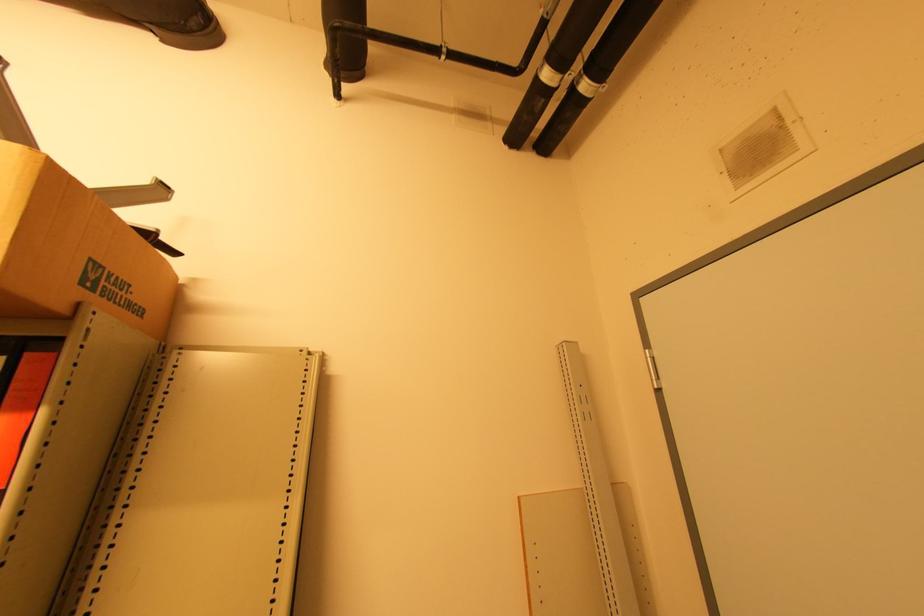
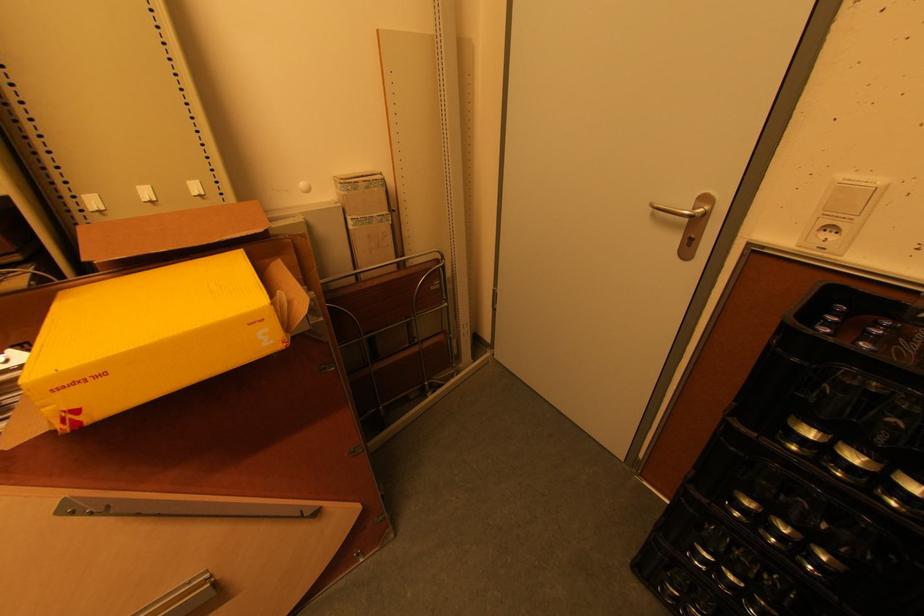
Based on the continuous images, in which direction is the camera rotating?

The camera's rotation is toward right-down.